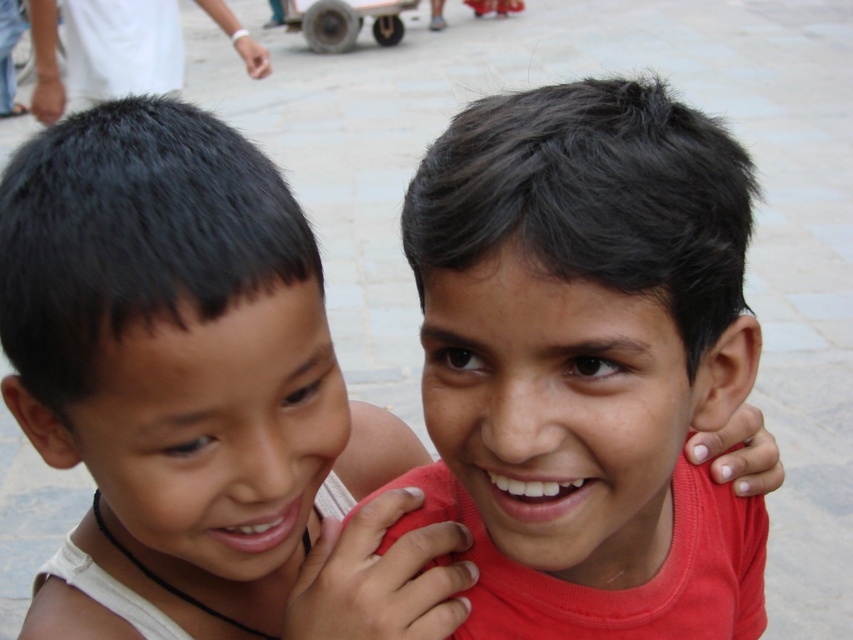
Question: Which point is closer to the camera?

Choices:
 (A) matte red shirt at center
 (B) smooth skin boy at left

Answer: (A)

Question: Is matte red shirt at center to the left of smooth skin boy at left from the viewer's perspective?

Choices:
 (A) no
 (B) yes

Answer: (A)

Question: Which object is positioned closest to the dark hair at upper left?

Choices:
 (A) matte red shirt at center
 (B) smooth skin boy at left

Answer: (B)

Question: Can you confirm if matte red shirt at center is wider than dark hair at upper left?

Choices:
 (A) yes
 (B) no

Answer: (B)

Question: Which object appears closest to the camera in this image?

Choices:
 (A) dark hair at upper left
 (B) smooth skin boy at left

Answer: (B)

Question: From the image, what is the correct spatial relationship of matte red shirt at center in relation to smooth skin boy at left?

Choices:
 (A) left
 (B) right

Answer: (B)